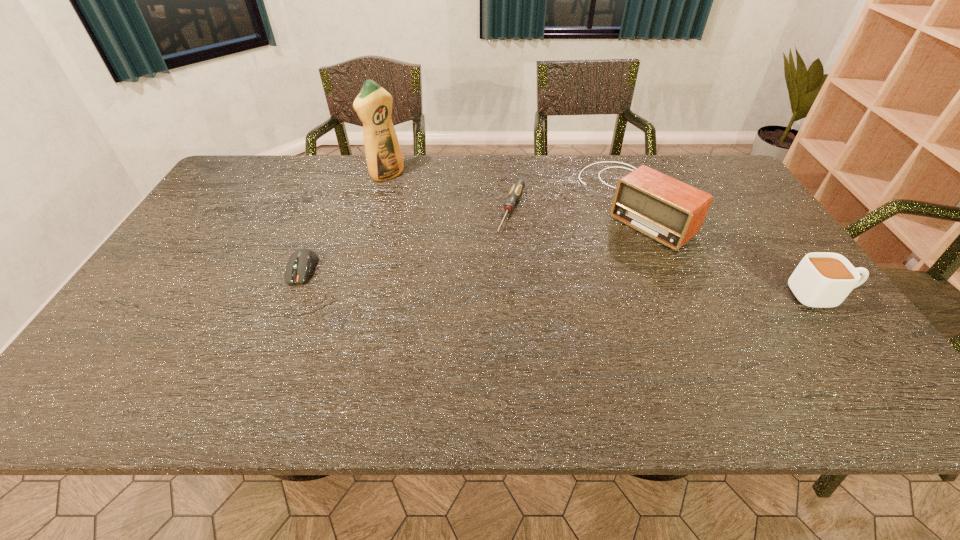
Find the location of a particular element. detergent that is at the far edge is located at coordinates (373, 104).

The height and width of the screenshot is (540, 960). I want to click on radio receiver at the far edge, so click(x=667, y=210).

At what (x,y) coordinates should I click in order to perform the action: click on screwdriver present at the far edge. Please return your answer as a coordinate pair (x, y). This screenshot has height=540, width=960. Looking at the image, I should click on (518, 186).

I want to click on object at the right edge, so click(822, 279).

This screenshot has height=540, width=960. In order to click on free space at the far edge in this screenshot , I will do `click(602, 177)`.

The width and height of the screenshot is (960, 540). I want to click on blank space at the near edge of the desktop, so click(330, 338).

This screenshot has width=960, height=540. Identify the location of vacant region at the left edge of the desktop. (148, 302).

At what (x,y) coordinates should I click in order to perform the action: click on vacant space at the right edge. Please return your answer as a coordinate pair (x, y). This screenshot has width=960, height=540. Looking at the image, I should click on (738, 197).

You are a GUI agent. You are given a task and a screenshot of the screen. Output one action in this format:
    pyautogui.click(x=<x>, y=<y>)
    Task: Click on the free point at the far left corner
    This screenshot has height=540, width=960.
    Given the screenshot: What is the action you would take?
    pyautogui.click(x=280, y=166)

Image resolution: width=960 pixels, height=540 pixels. Find the location of `vacant space at the far right corner`. vacant space at the far right corner is located at coordinates (720, 190).